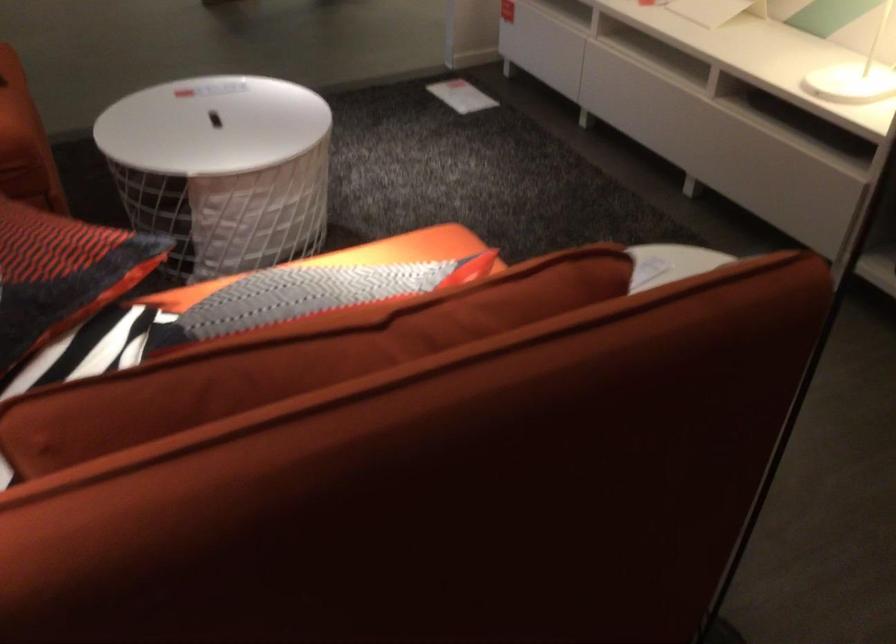
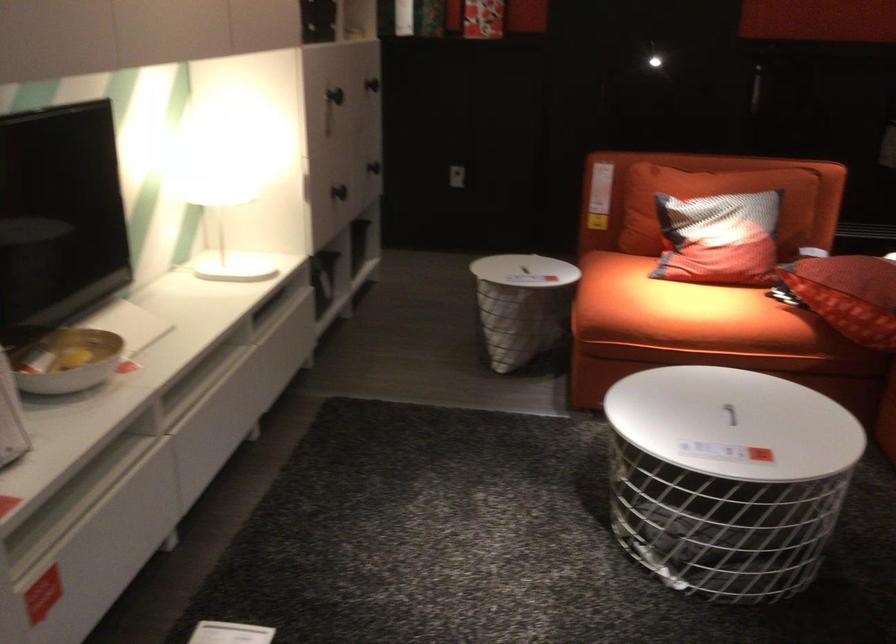
The point at (203, 129) is marked in the first image. Where is the corresponding point in the second image?

(729, 413)